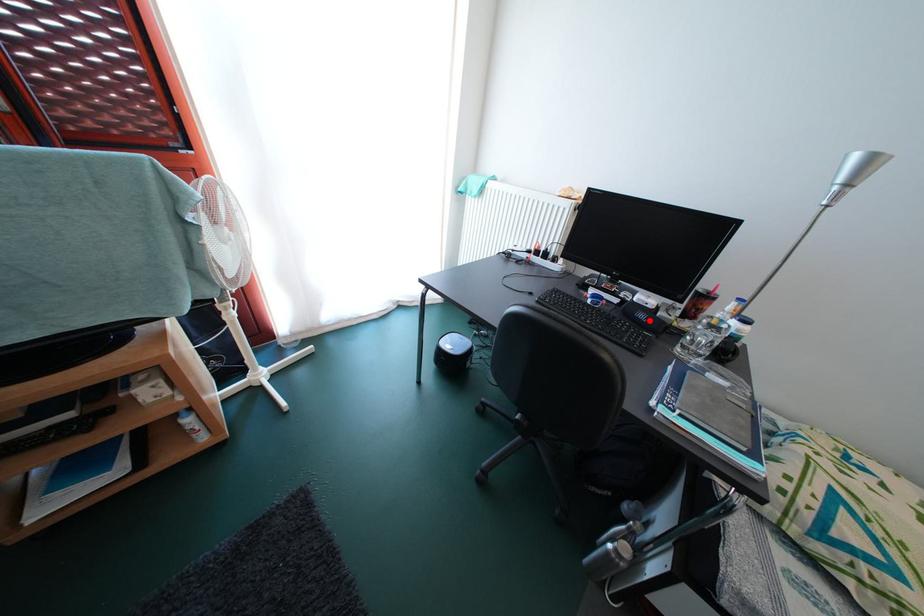
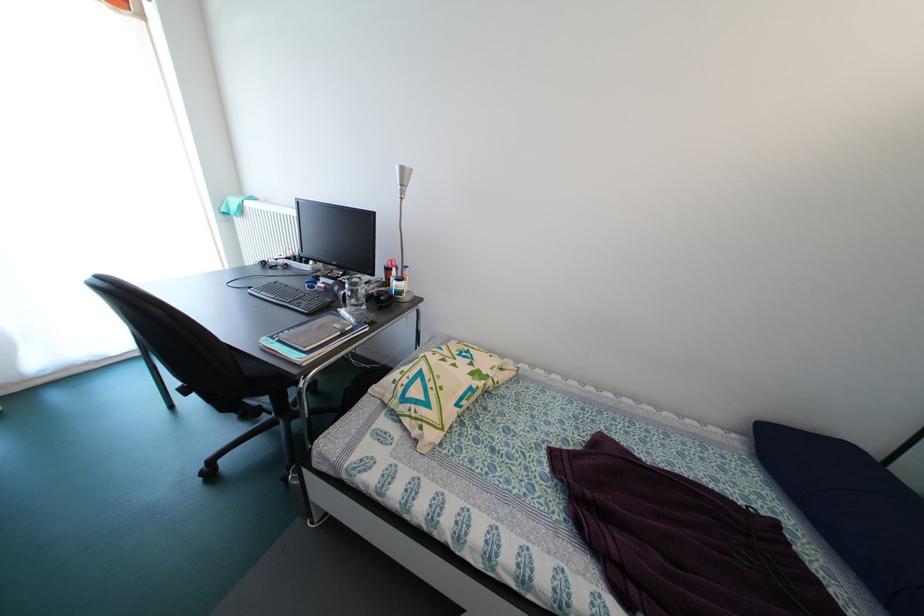
In the second image, find the point that corresponds to the highlighted location in the first image.

(344, 294)